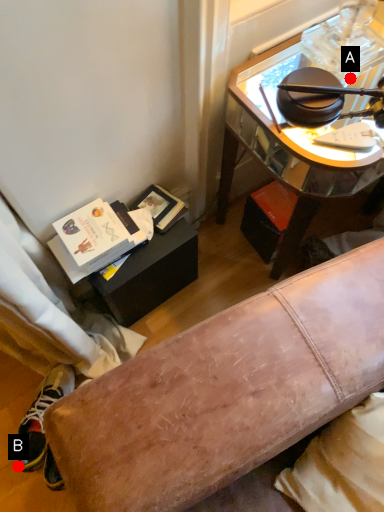
Question: Two points are circled on the image, labeled by A and B beside each circle. Which point is further to the camera?

Choices:
 (A) A is further
 (B) B is further

Answer: (B)